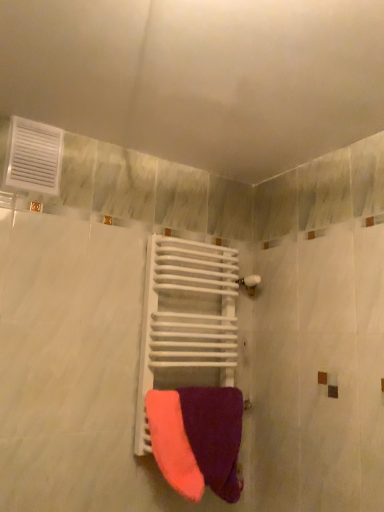
Question: Is white plastic vent at upper left surrounding white matte towel rack at center?

Choices:
 (A) no
 (B) yes

Answer: (A)

Question: Is white plastic vent at upper left outside white matte towel rack at center?

Choices:
 (A) no
 (B) yes

Answer: (B)

Question: Could you tell me if white plastic vent at upper left is turned towards white matte towel rack at center?

Choices:
 (A) no
 (B) yes

Answer: (A)

Question: Does white plastic vent at upper left have a greater height compared to white matte towel rack at center?

Choices:
 (A) no
 (B) yes

Answer: (A)

Question: From a real-world perspective, is white plastic vent at upper left positioned over white matte towel rack at center based on gravity?

Choices:
 (A) no
 (B) yes

Answer: (B)

Question: Is white plastic vent at upper left wider than white matte towel rack at center?

Choices:
 (A) yes
 (B) no

Answer: (B)

Question: Is white plastic vent at upper left far from purple soft towel at center?

Choices:
 (A) no
 (B) yes

Answer: (A)

Question: From the image's perspective, is white plastic vent at upper left over purple soft towel at center?

Choices:
 (A) yes
 (B) no

Answer: (A)

Question: Can you confirm if white plastic vent at upper left is taller than purple soft towel at center?

Choices:
 (A) no
 (B) yes

Answer: (A)

Question: Considering the relative sizes of white plastic vent at upper left and purple soft towel at center in the image provided, is white plastic vent at upper left shorter than purple soft towel at center?

Choices:
 (A) yes
 (B) no

Answer: (A)

Question: Is purple soft towel at center at the back of white plastic vent at upper left?

Choices:
 (A) no
 (B) yes

Answer: (A)

Question: From the image's perspective, is white plastic vent at upper left located beneath purple soft towel at center?

Choices:
 (A) yes
 (B) no

Answer: (B)

Question: Does white matte towel rack at center have a larger size compared to white plastic vent at upper left?

Choices:
 (A) no
 (B) yes

Answer: (B)